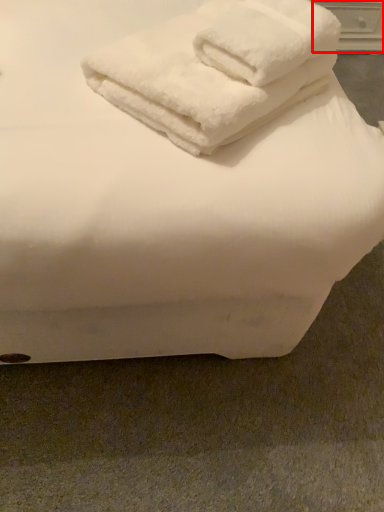
Question: Considering the relative positions of drawer (annotated by the red box) and towel in the image provided, where is drawer (annotated by the red box) located with respect to the staircase?

Choices:
 (A) left
 (B) right

Answer: (B)